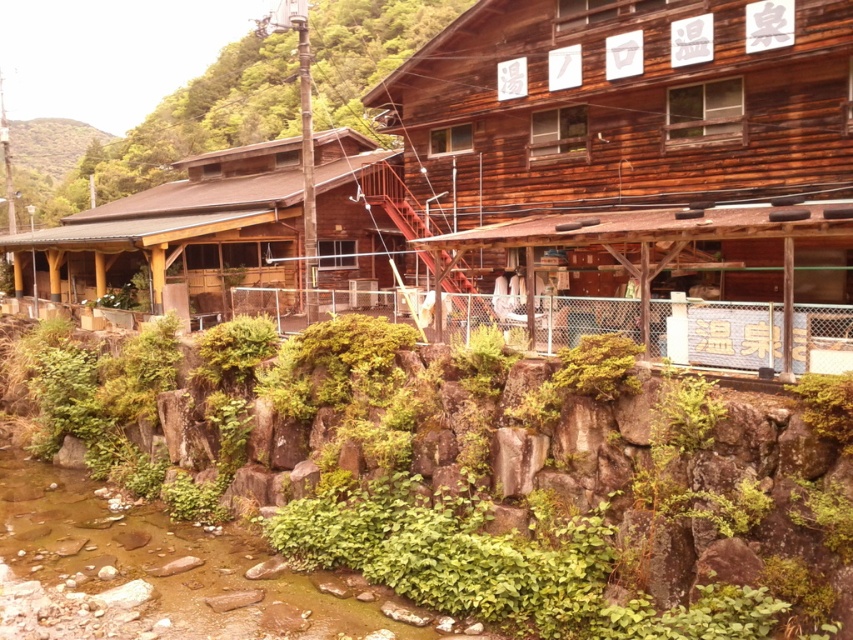
Is green mossy rock at lower center bigger than wooden hut at center?

No.

Does point (212, 506) come closer to viewer compared to point (511, 243)?

No, it is behind (511, 243).

You are a GUI agent. You are given a task and a screenshot of the screen. Output one action in this format:
    pyautogui.click(x=<x>, y=<y>)
    Task: Click on the green mossy rock at lower center
    Image resolution: width=853 pixels, height=640 pixels.
    Given the screenshot: What is the action you would take?
    pyautogui.click(x=466, y=477)

Can you confirm if wooden hut at center is bigger than brown wooden hut at center?

Incorrect, wooden hut at center is not larger than brown wooden hut at center.

Is wooden hut at center to the left of brown wooden hut at center from the viewer's perspective?

In fact, wooden hut at center is to the right of brown wooden hut at center.

Find the location of a particular element. Image resolution: width=853 pixels, height=640 pixels. wooden hut at center is located at coordinates (643, 164).

Which is below, green mossy rock at lower center or green leafy hillside at upper left?

green mossy rock at lower center is below.

Looking at this image, does green mossy rock at lower center have a lesser height compared to green leafy hillside at upper left?

Yes, green mossy rock at lower center is shorter than green leafy hillside at upper left.

Between point (677, 618) and point (27, 131), which one is positioned behind?

Positioned behind is point (27, 131).

Find the location of a particular element. Image resolution: width=853 pixels, height=640 pixels. green mossy rock at lower center is located at coordinates (466, 477).